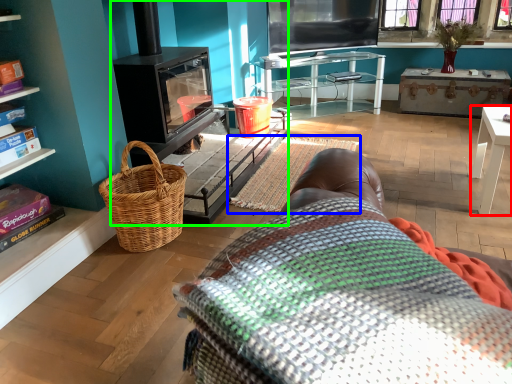
Question: Which is nearer to the table (highlighted by a red box)? blanket (highlighted by a blue box) or fireplace (highlighted by a green box).

Choices:
 (A) blanket
 (B) fireplace

Answer: (A)